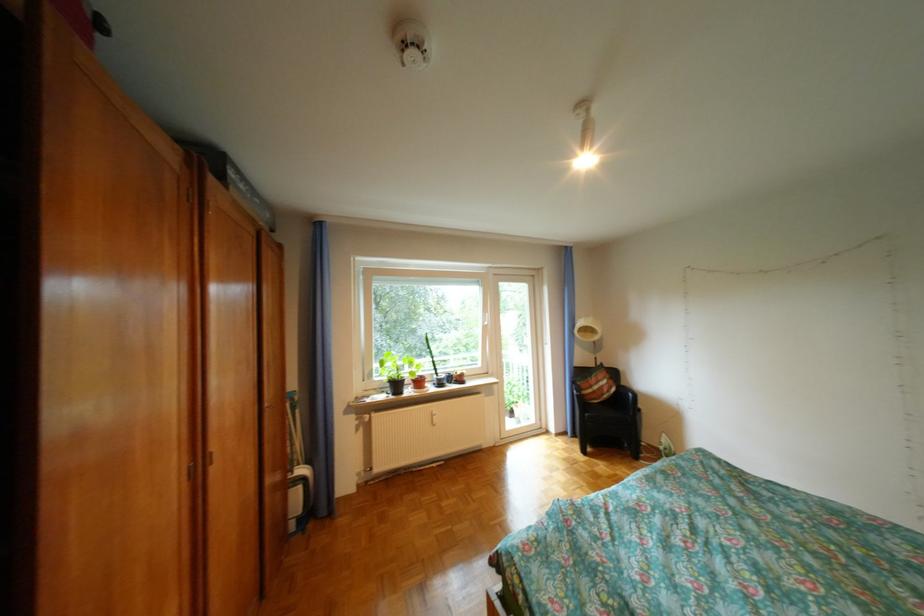
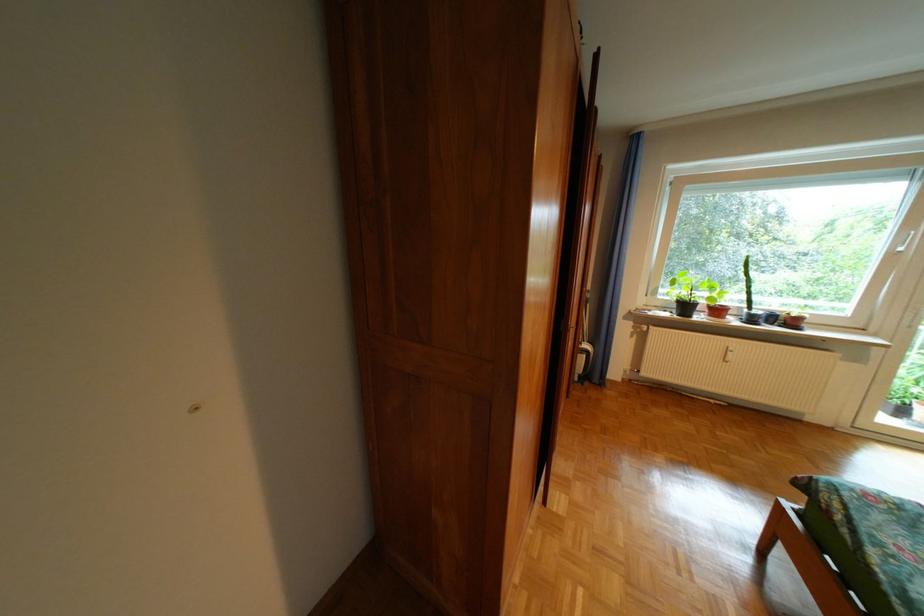
Locate, in the second image, the point that corresponds to the point at 423,392 in the first image.

(714, 318)